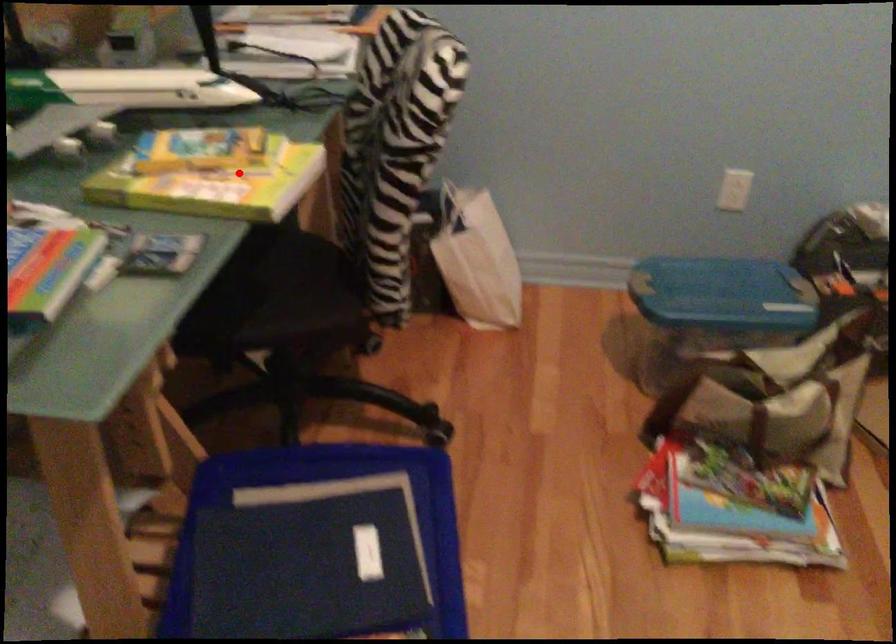
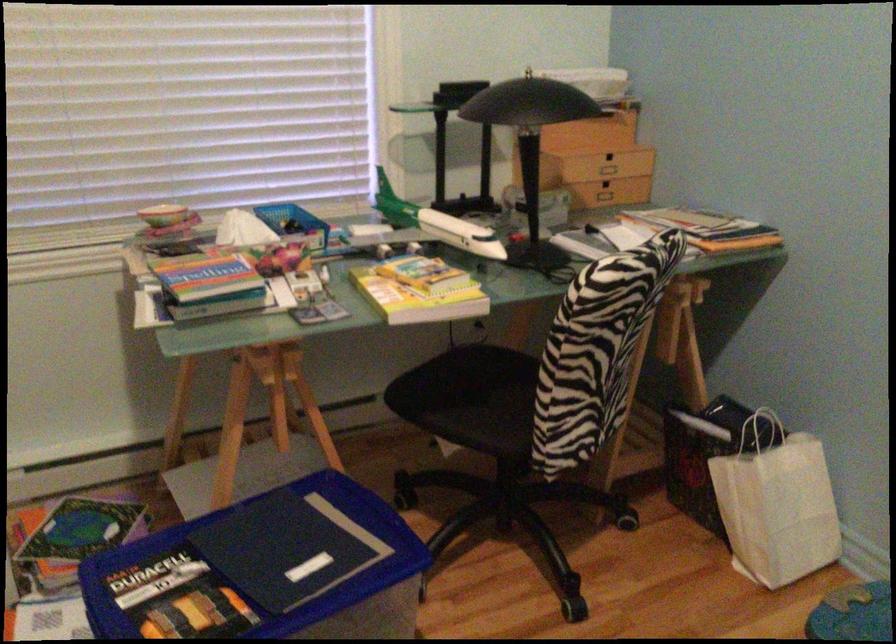
Question: I am providing you with two images of the same scene from different viewpoints. A red point is marked on the first image. Is the red point's position out of view in image 2?

Choices:
 (A) Yes
 (B) No

Answer: (B)